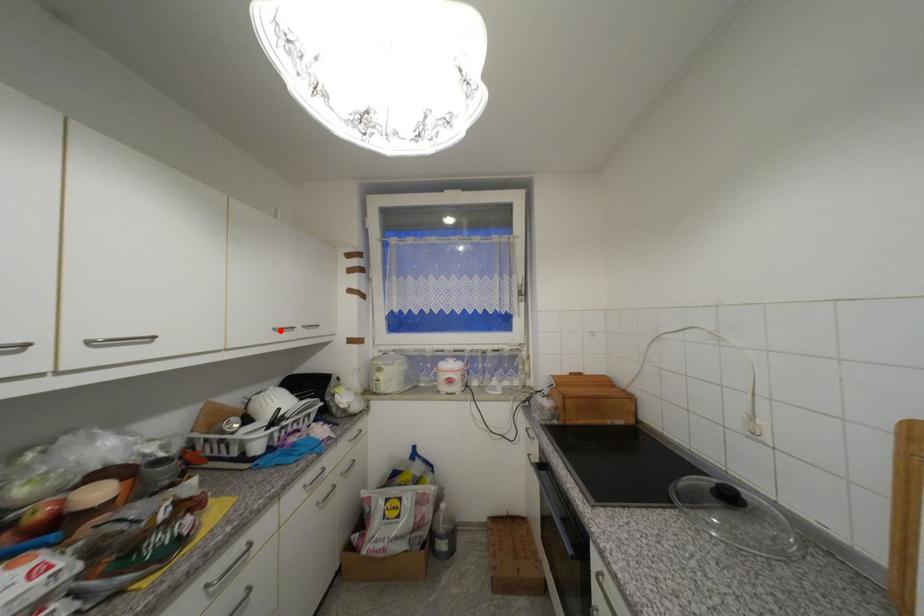
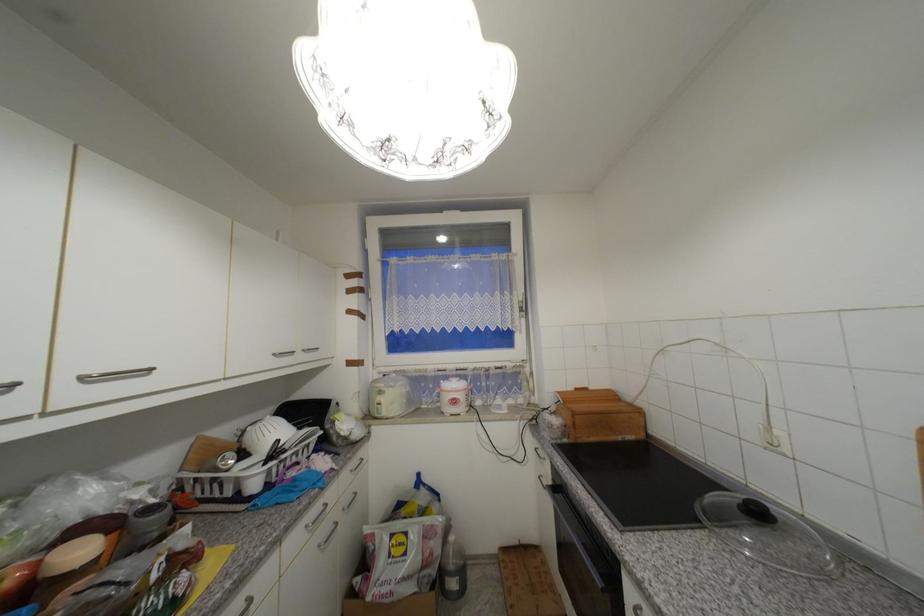
The point at the highlighted location is marked in the first image. Where is the corresponding point in the second image?

(281, 355)